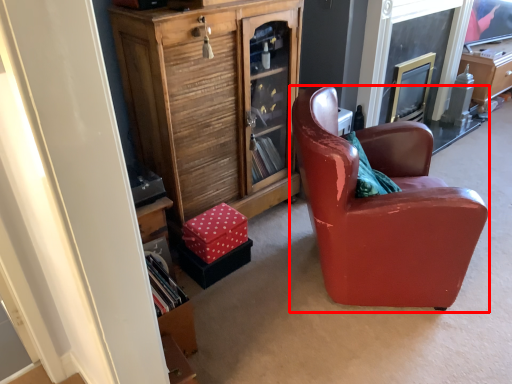
Question: Observing the image, what is the correct spatial positioning of chair (annotated by the red box) in reference to cabinetry?

Choices:
 (A) left
 (B) right

Answer: (B)